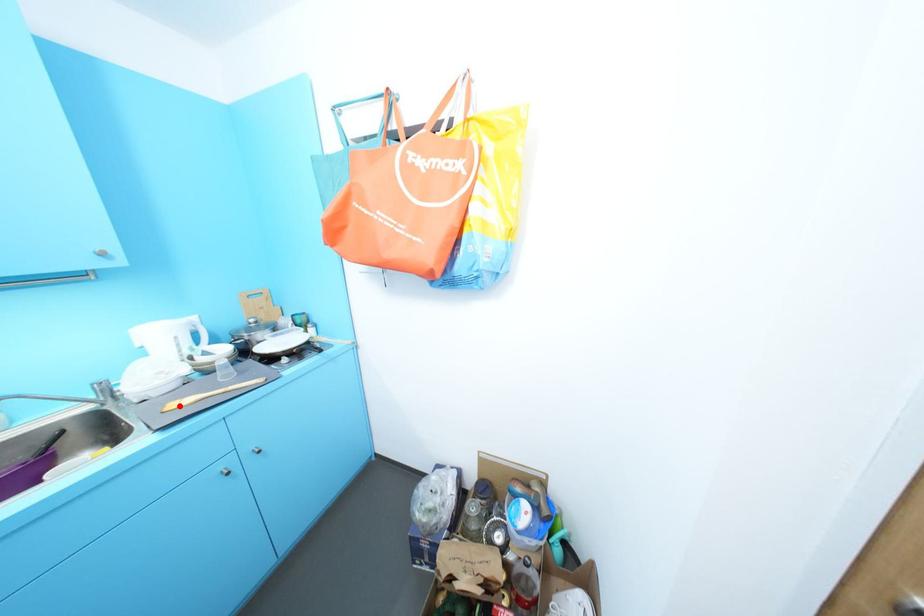
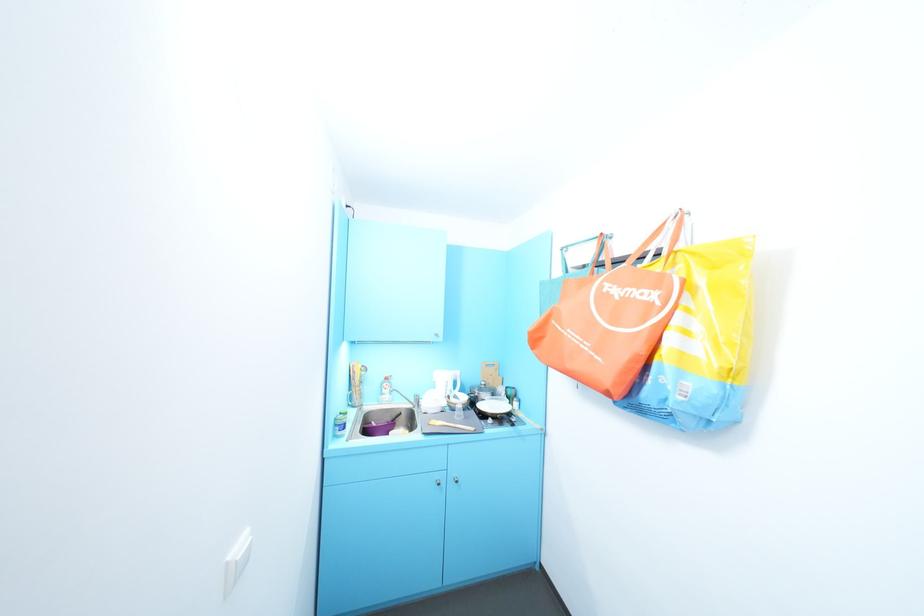
Find the pixel in the second image that matches the highlighted location in the first image.

(440, 423)